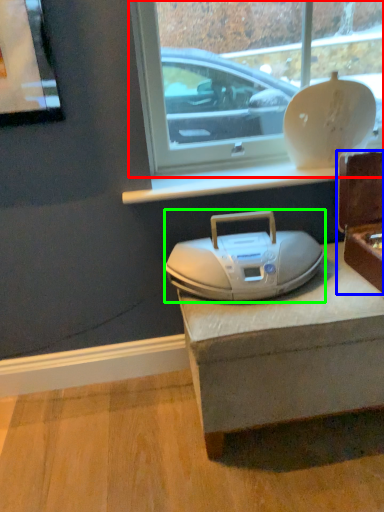
Question: Which object is the closest to the window (highlighted by a red box)? Choose among these: box (highlighted by a blue box) or appliance (highlighted by a green box).

Choices:
 (A) box
 (B) appliance

Answer: (A)